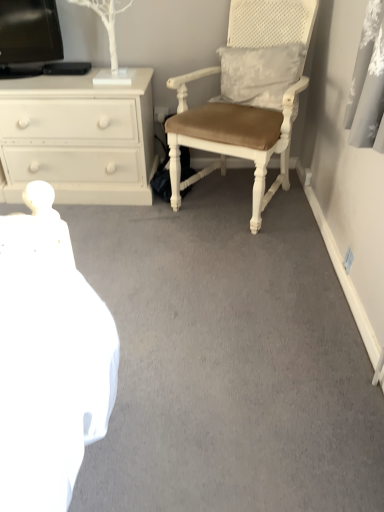
The height and width of the screenshot is (512, 384). What do you see at coordinates (246, 99) in the screenshot?
I see `white wood chair at right` at bounding box center [246, 99].

The image size is (384, 512). I want to click on white wood chair at right, so click(x=246, y=99).

The height and width of the screenshot is (512, 384). Describe the element at coordinates (78, 138) in the screenshot. I see `white painted wood chest of drawers at left` at that location.

Image resolution: width=384 pixels, height=512 pixels. What are the coordinates of `white painted wood chest of drawers at left` in the screenshot? It's located at (78, 138).

Find the location of a particular element. This screenshot has height=512, width=384. white wood chair at right is located at coordinates (246, 99).

Considering the relative positions of white wood chair at right and white painted wood chest of drawers at left in the image provided, is white wood chair at right to the right of white painted wood chest of drawers at left from the viewer's perspective?

Yes.

Considering the positions of objects white wood chair at right and white painted wood chest of drawers at left in the image provided, who is behind, white wood chair at right or white painted wood chest of drawers at left?

white painted wood chest of drawers at left is more distant.

Considering the points (274, 122) and (33, 168), which point is behind, point (274, 122) or point (33, 168)?

The point (33, 168) is more distant.

From the image's perspective, is white wood chair at right located beneath white painted wood chest of drawers at left?

No.

From a real-world perspective, is white wood chair at right positioned above or below white painted wood chest of drawers at left?

white wood chair at right is above white painted wood chest of drawers at left.

Is white wood chair at right wider or thinner than white painted wood chest of drawers at left?

Considering their sizes, white wood chair at right looks broader than white painted wood chest of drawers at left.

Can you confirm if white wood chair at right is shorter than white painted wood chest of drawers at left?

In fact, white wood chair at right may be taller than white painted wood chest of drawers at left.

In terms of size, does white wood chair at right appear bigger or smaller than white painted wood chest of drawers at left?

In the image, white wood chair at right appears to be larger than white painted wood chest of drawers at left.

Could white painted wood chest of drawers at left be considered to be inside white wood chair at right?

No, white painted wood chest of drawers at left is located outside of white wood chair at right.

Would you consider white wood chair at right to be distant from white painted wood chest of drawers at left?

white wood chair at right is actually quite close to white painted wood chest of drawers at left.

Is white wood chair at right facing away from white painted wood chest of drawers at left?

No, white wood chair at right is not facing away from white painted wood chest of drawers at left.

Can you tell me how much white wood chair at right and white painted wood chest of drawers at left differ in facing direction?

The angle between the facing direction of white wood chair at right and the facing direction of white painted wood chest of drawers at left is 27.8 degrees.

How far apart are white wood chair at right and white painted wood chest of drawers at left?

white wood chair at right is 46.22 centimeters away from white painted wood chest of drawers at left.

This screenshot has width=384, height=512. I want to click on chest of drawers on the left side of white wood chair at right, so click(x=78, y=138).

Can you confirm if white painted wood chest of drawers at left is positioned to the left of white wood chair at right?

Yes, white painted wood chest of drawers at left is to the left of white wood chair at right.

Which object is more forward, white painted wood chest of drawers at left or white wood chair at right?

white wood chair at right is more forward.

Consider the image. Which is nearer, (17, 197) or (172, 153)?

Point (17, 197)

From the image's perspective, would you say white painted wood chest of drawers at left is shown under white wood chair at right?

Yes, from the image's perspective, white painted wood chest of drawers at left is beneath white wood chair at right.

From a real-world perspective, is white painted wood chest of drawers at left positioned under white wood chair at right based on gravity?

Yes, from a real-world perspective, white painted wood chest of drawers at left is under white wood chair at right.

Between white painted wood chest of drawers at left and white wood chair at right, which one has larger width?

Wider between the two is white wood chair at right.

Does white painted wood chest of drawers at left have a greater height compared to white wood chair at right?

Incorrect, the height of white painted wood chest of drawers at left is not larger of that of white wood chair at right.

Is white painted wood chest of drawers at left smaller than white wood chair at right?

Yes, white painted wood chest of drawers at left is smaller than white wood chair at right.

Can we say white painted wood chest of drawers at left lies outside white wood chair at right?

Yes.

Are white painted wood chest of drawers at left and white wood chair at right making contact?

No, white painted wood chest of drawers at left is not in contact with white wood chair at right.

Is white painted wood chest of drawers at left turned away from white wood chair at right?

No, white painted wood chest of drawers at left's orientation is not away from white wood chair at right.

Measure the distance between white painted wood chest of drawers at left and white wood chair at right.

18.20 inches.

This screenshot has height=512, width=384. There is a white painted wood chest of drawers at left. Find the location of `chair above it (from a real-world perspective)`. chair above it (from a real-world perspective) is located at coordinates (246, 99).

Locate an element on the screen. chair that is above the white painted wood chest of drawers at left (from the image's perspective) is located at coordinates (246, 99).

The width and height of the screenshot is (384, 512). I want to click on the chest of drawers located underneath the white wood chair at right (from a real-world perspective), so tap(78, 138).